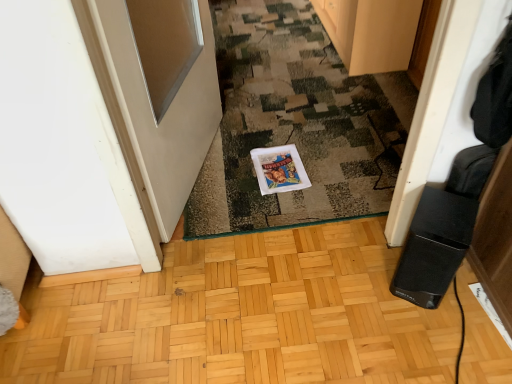
Identify the location of free spot behind black plastic speaker at lower right. (376, 239).